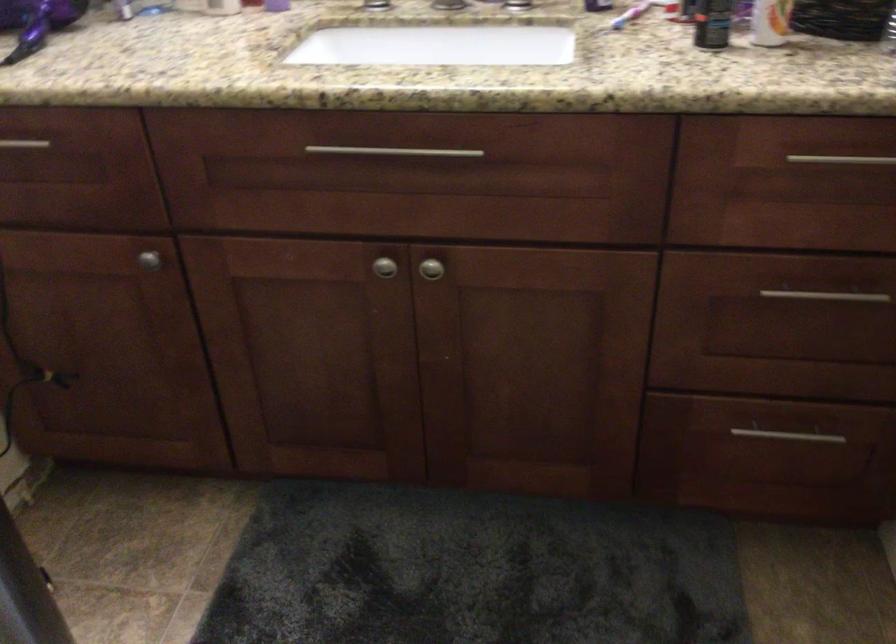
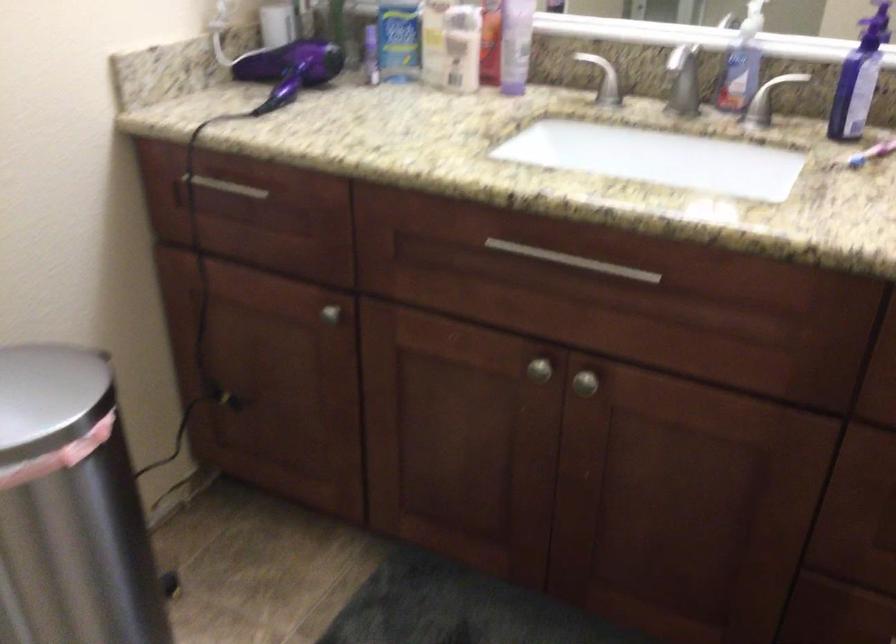
Question: The first image is from the beginning of the video and the second image is from the end. How did the camera likely rotate when shooting the video?

Choices:
 (A) Left
 (B) Right
 (C) Up
 (D) Down

Answer: (A)